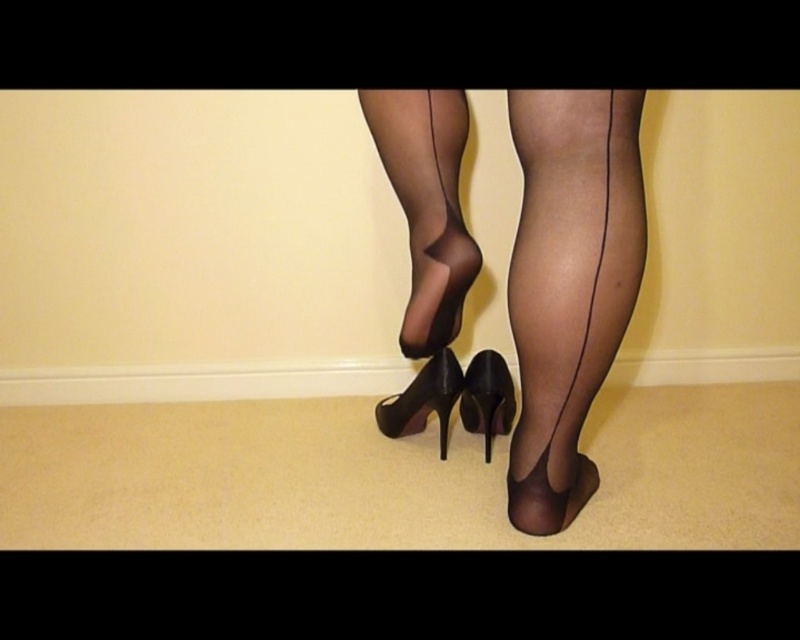
Question: Which point is farther to the camera?

Choices:
 (A) black leather high-heeled shoe at center
 (B) transparent nylon stockings at center
 (C) shiny black high-heeled shoe at center
 (D) sheer black tights at center

Answer: (A)

Question: Can you confirm if transparent nylon stockings at center is bigger than shiny black high-heeled shoe at center?

Choices:
 (A) no
 (B) yes

Answer: (B)

Question: Which object is farther from the camera taking this photo?

Choices:
 (A) transparent nylon stockings at center
 (B) transparent nylon leg at center

Answer: (B)

Question: Is sheer black tights at center bigger than shiny black high-heeled shoe at center?

Choices:
 (A) yes
 (B) no

Answer: (A)

Question: Which of the following is the closest to the observer?

Choices:
 (A) (506, 410)
 (B) (410, 394)
 (C) (397, 180)

Answer: (C)

Question: Does transparent nylon stockings at center appear on the right side of black leather high-heeled shoe at center?

Choices:
 (A) yes
 (B) no

Answer: (A)